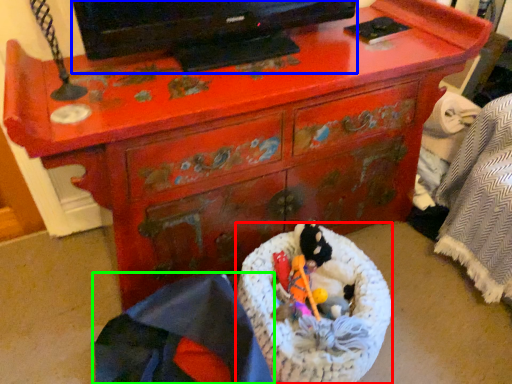
Question: Which is farther away from laundry basket (highlighted by a red box)? television (highlighted by a blue box) or material (highlighted by a green box)?

Choices:
 (A) television
 (B) material

Answer: (A)